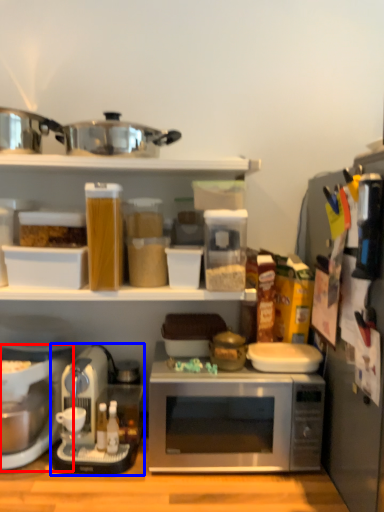
Question: Which point is further to the camera, coffee maker (highlighted by a red box) or coffee maker (highlighted by a blue box)?

Choices:
 (A) coffee maker
 (B) coffee maker

Answer: (B)